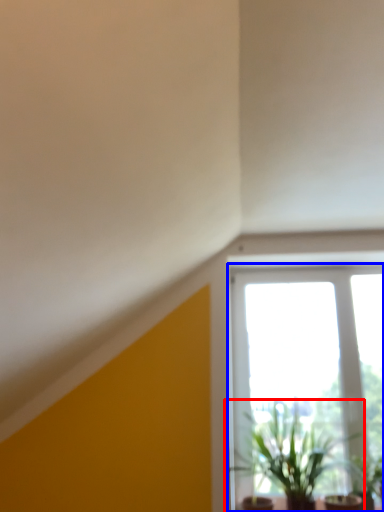
Question: Among these objects, which one is farthest to the camera, houseplant (highlighted by a red box) or window (highlighted by a blue box)?

Choices:
 (A) houseplant
 (B) window

Answer: (B)